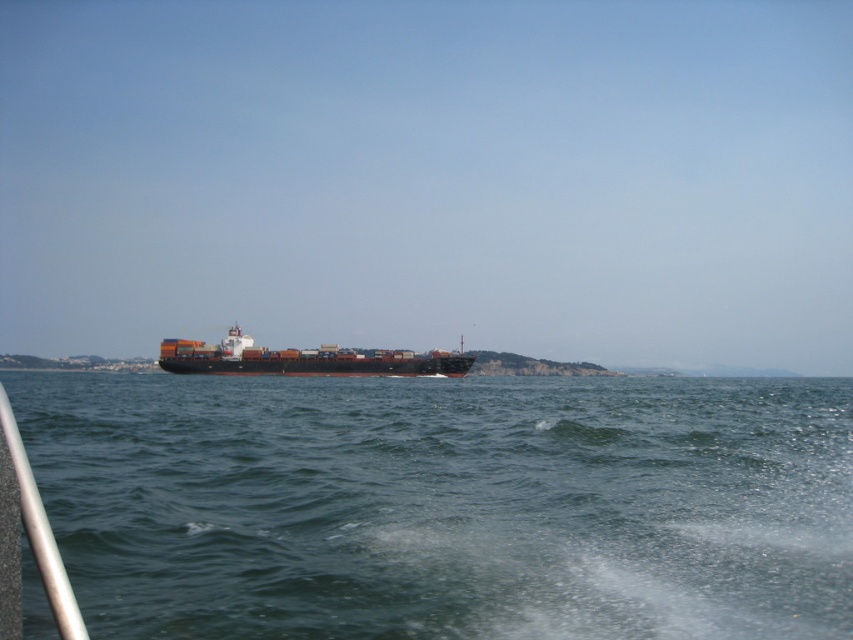
Question: Does green water at center have a larger size compared to brown matte container ship at center?

Choices:
 (A) yes
 (B) no

Answer: (A)

Question: Is green water at center above brown matte container ship at center?

Choices:
 (A) yes
 (B) no

Answer: (B)

Question: In this image, where is green water at center located relative to brown matte container ship at center?

Choices:
 (A) above
 (B) below

Answer: (B)

Question: Which point is farther to the camera?

Choices:
 (A) (631, 548)
 (B) (444, 365)

Answer: (B)

Question: Which point is farther to the camera?

Choices:
 (A) (734, 416)
 (B) (412, 355)

Answer: (B)